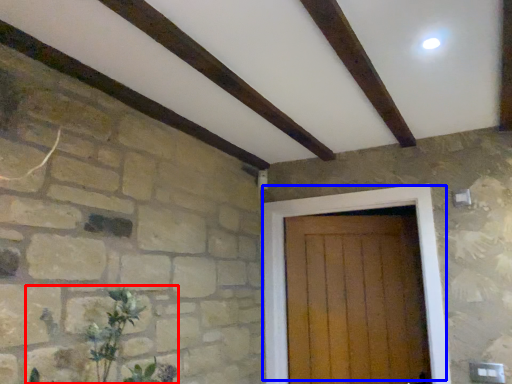
Question: Which object appears farthest to the camera in this image, plant (highlighted by a red box) or door (highlighted by a blue box)?

Choices:
 (A) plant
 (B) door

Answer: (B)